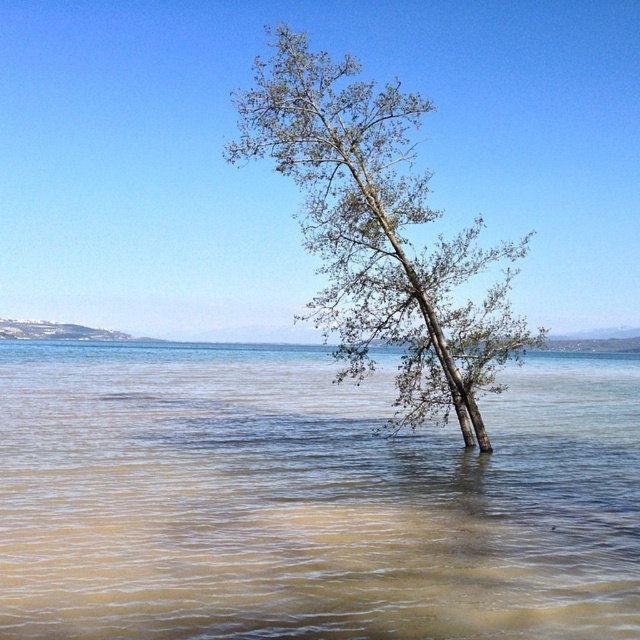
Between point (128, 422) and point (364, 196), which one is positioned behind?

The point (128, 422) is behind.

Locate an element on the screen. This screenshot has width=640, height=640. brown muddy water at center is located at coordinates (308, 499).

You are a GUI agent. You are given a task and a screenshot of the screen. Output one action in this format:
    pyautogui.click(x=<x>, y=<y>)
    Task: Click on the brown muddy water at center
    The width and height of the screenshot is (640, 640).
    Given the screenshot: What is the action you would take?
    pyautogui.click(x=308, y=499)

Identify the location of brown muddy water at center. Image resolution: width=640 pixels, height=640 pixels. (308, 499).